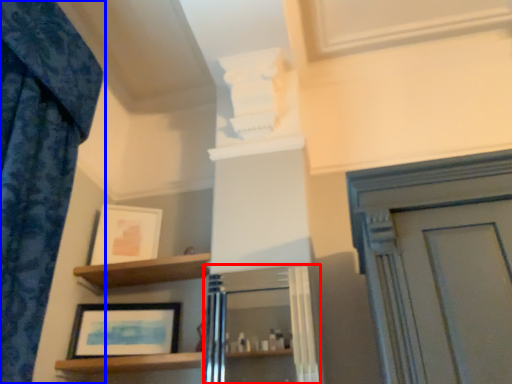
Question: Among these objects, which one is farthest to the camera, cabinetry (highlighted by a red box) or curtain (highlighted by a blue box)?

Choices:
 (A) cabinetry
 (B) curtain

Answer: (A)